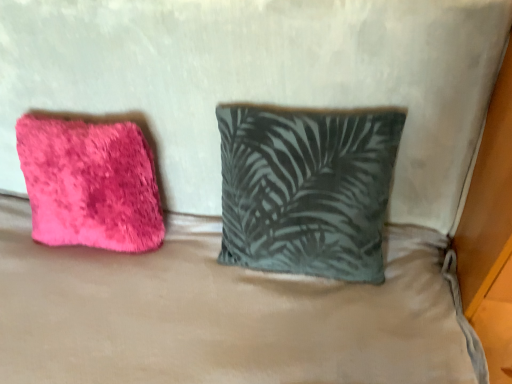
Measure the distance between fuzzy pink pillow at left and camera.

fuzzy pink pillow at left and camera are 1.01 meters apart.

Image resolution: width=512 pixels, height=384 pixels. Identify the location of fuzzy pink pillow at left. (90, 184).

What do you see at coordinates (90, 184) in the screenshot?
I see `fuzzy pink pillow at left` at bounding box center [90, 184].

This screenshot has width=512, height=384. What are the coordinates of `fuzzy pink pillow at left` in the screenshot? It's located at (90, 184).